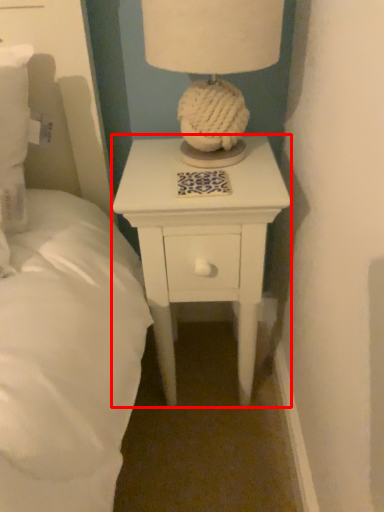
Question: In this image, where is nightstand (annotated by the red box) located relative to table lamp?

Choices:
 (A) right
 (B) left

Answer: (B)